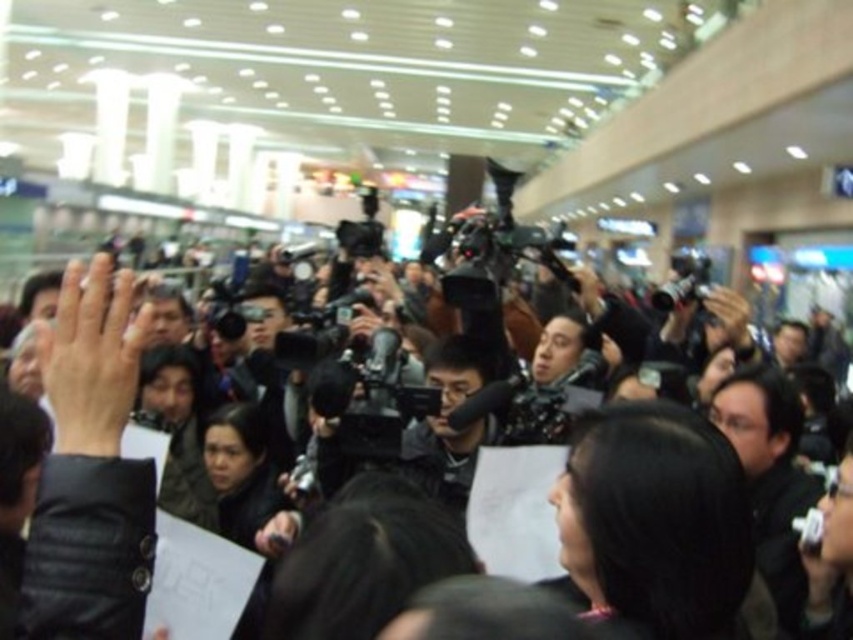
Question: Is black matte camera at center closer to camera compared to black plastic video camera at center?

Choices:
 (A) yes
 (B) no

Answer: (A)

Question: Where is black matte camera at center located in relation to black plastic video camera at center in the image?

Choices:
 (A) right
 (B) left

Answer: (B)

Question: Which point is farther from the camera taking this photo?

Choices:
 (A) (107, 493)
 (B) (672, 291)

Answer: (B)

Question: Can you confirm if black matte camera at center is smaller than black plastic video camera at center?

Choices:
 (A) no
 (B) yes

Answer: (B)